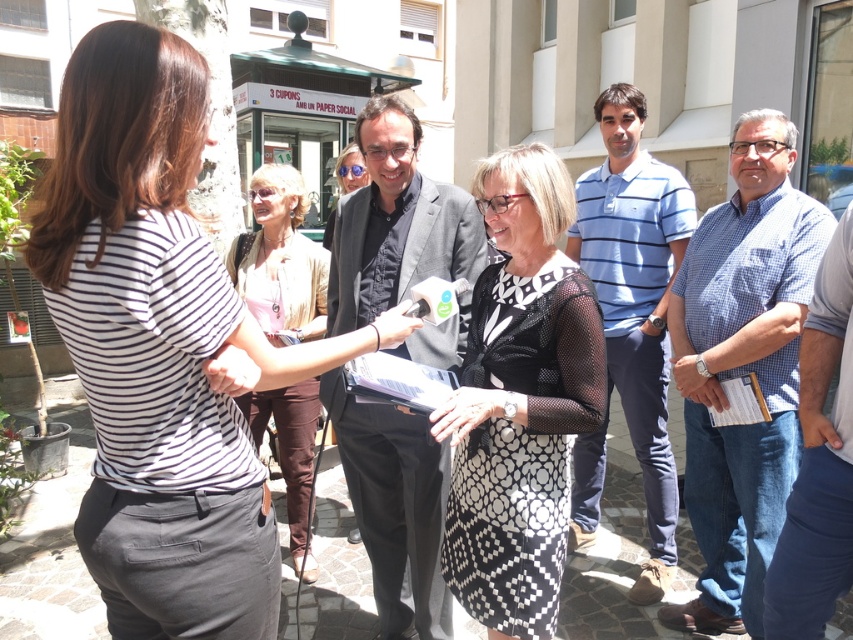
Question: Does black printed dress at center appear on the left side of blue striped polo shirt at center?

Choices:
 (A) yes
 (B) no

Answer: (A)

Question: Is the position of black printed dress at center less distant than that of blue striped polo shirt at center?

Choices:
 (A) yes
 (B) no

Answer: (A)

Question: Considering the real-world distances, which object is farthest from the blue checkered shirt at center?

Choices:
 (A) black printed dress at center
 (B) light pink fabric blouse at center

Answer: (B)

Question: Does black printed dress at center lie in front of light pink fabric blouse at center?

Choices:
 (A) yes
 (B) no

Answer: (A)

Question: Which point is closer to the camera taking this photo?

Choices:
 (A) (770, 216)
 (B) (347, 420)
 (C) (807, 451)

Answer: (C)

Question: Which point is closer to the camera?

Choices:
 (A) (793, 216)
 (B) (277, 294)

Answer: (A)